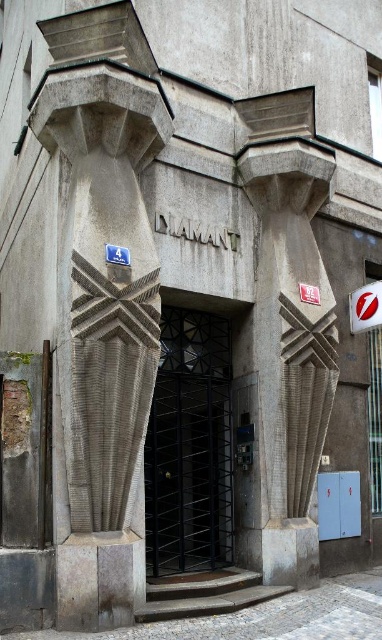
Question: Which object appears farthest from the camera in this image?

Choices:
 (A) gray stone column at center
 (B) black metal gate at center

Answer: (A)

Question: Estimate the real-world distances between objects in this image. Which object is farther from the gray stone column at center?

Choices:
 (A) gray textured column at left
 (B) black metal gate at center

Answer: (A)

Question: Among these objects, which one is nearest to the camera?

Choices:
 (A) black metal gate at center
 (B) white plastic sign at upper right

Answer: (A)

Question: Can you confirm if gray stone column at center is positioned above white plastic sign at upper right?

Choices:
 (A) no
 (B) yes

Answer: (A)

Question: Can you confirm if gray stone column at center is thinner than black metal gate at center?

Choices:
 (A) yes
 (B) no

Answer: (A)

Question: Where is gray stone column at center located in relation to white plastic sign at upper right in the image?

Choices:
 (A) right
 (B) left

Answer: (B)